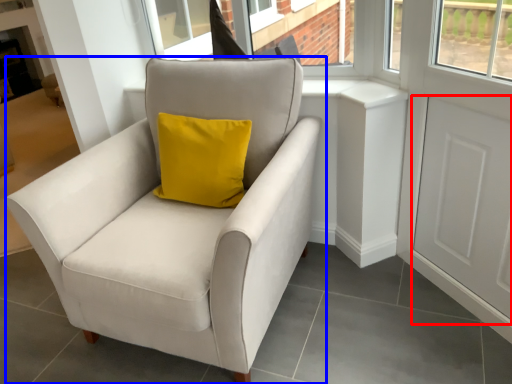
Question: Which point is closer to the camera, screen door (highlighted by a red box) or chair (highlighted by a blue box)?

Choices:
 (A) screen door
 (B) chair

Answer: (B)